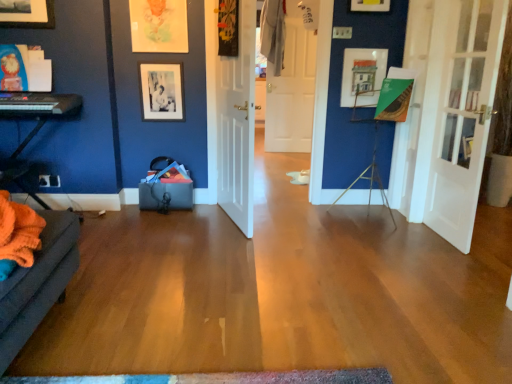
Question: Based on their sizes in the image, would you say white glass door at right, marked as the third door in a back-to-front arrangement, is bigger or smaller than metallic tripod at center-right?

Choices:
 (A) small
 (B) big

Answer: (A)

Question: Is white glass door at right, which appears as the 1th door when viewed from the right, taller or shorter than metallic tripod at center-right?

Choices:
 (A) tall
 (B) short

Answer: (A)

Question: Which object is positioned closest to the white wooden door at center, positioned as the second door in back-to-front order?

Choices:
 (A) black matte keyboard at left
 (B) white glass door at right, which appears as the 1th door when viewed from the right
 (C) metallic tripod at center-right
 (D) white matte door at center, acting as the 2th door starting from the left
 (E) matte wooden picture frame at upper center, acting as the third picture frame starting from the left

Answer: (E)

Question: Estimate the real-world distances between objects in this image. Which object is farther from the multicolored woven mat at lower center?

Choices:
 (A) black matte keyboard at left
 (B) orange fabric couch at left
 (C) white wooden door at center, positioned as the second door in back-to-front order
 (D) white matte door at center, which is the third door in front-to-back order
 (E) black matte picture frame at upper center, which is counted as the third picture frame, starting from the right

Answer: (D)